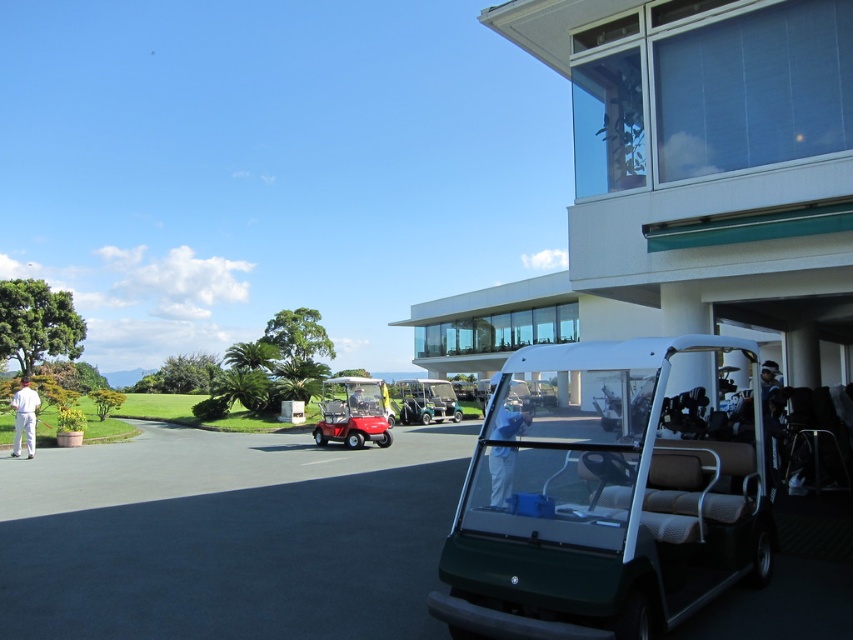
Which is in front, point (502, 371) or point (335, 381)?

Point (502, 371) is more forward.

Can you confirm if green matte golf cart at center is bigger than matte red golf cart at center?

Yes, green matte golf cart at center is bigger than matte red golf cart at center.

Image resolution: width=853 pixels, height=640 pixels. What do you see at coordinates (606, 497) in the screenshot? I see `green matte golf cart at center` at bounding box center [606, 497].

Locate an element on the screen. green matte golf cart at center is located at coordinates (606, 497).

Consider the image. Does green plastic golf cart at center have a lesser height compared to white cotton pants at lower left?

Incorrect, green plastic golf cart at center's height does not fall short of white cotton pants at lower left's.

Which is more to the left, green plastic golf cart at center or white cotton pants at lower left?

From the viewer's perspective, white cotton pants at lower left appears more on the left side.

Is point (404, 388) positioned before point (38, 406)?

That is False.

Find the location of a particular element. This screenshot has width=853, height=640. green plastic golf cart at center is located at coordinates (425, 401).

Is matte red golf cart at center above white cotton pants at lower left?

Incorrect, matte red golf cart at center is not positioned above white cotton pants at lower left.

Is matte red golf cart at center further to the viewer compared to white cotton pants at lower left?

Yes, it is behind white cotton pants at lower left.

At what (x,y) coordinates should I click in order to perform the action: click on matte red golf cart at center. Please return your answer as a coordinate pair (x, y). Looking at the image, I should click on (352, 412).